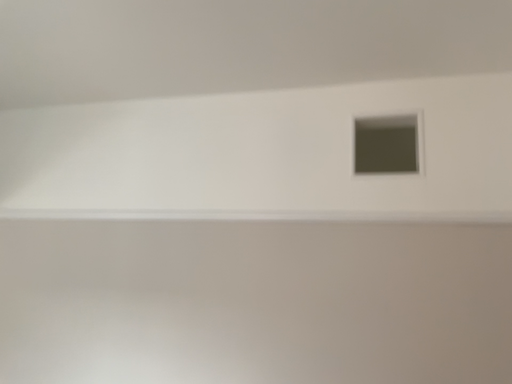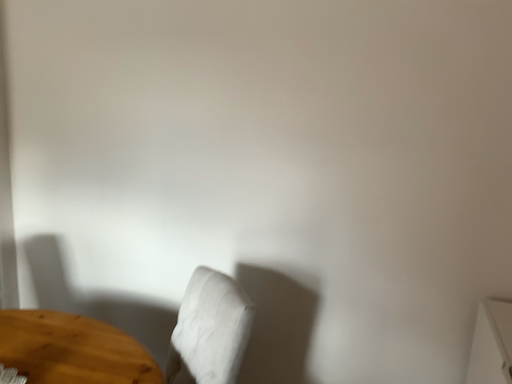
Question: How did the camera likely rotate when shooting the video?

Choices:
 (A) rotated upward
 (B) rotated downward

Answer: (B)